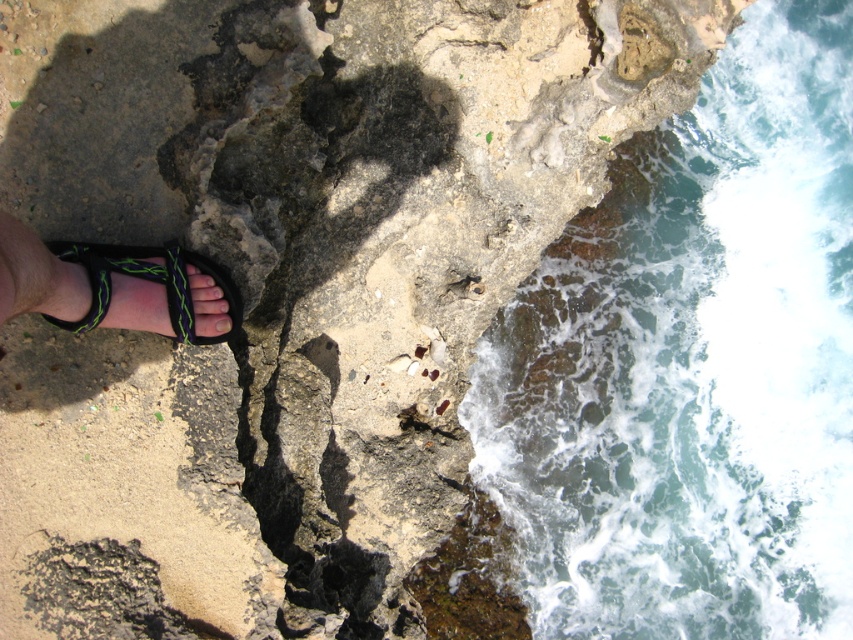
Is clear water at lower right to the right of pale yellow nail at lower left from the viewer's perspective?

Correct, you'll find clear water at lower right to the right of pale yellow nail at lower left.

Which of these two, clear water at lower right or pale yellow nail at lower left, stands taller?

With more height is clear water at lower right.

The height and width of the screenshot is (640, 853). Find the location of `clear water at lower right`. clear water at lower right is located at coordinates (692, 365).

Between clear water at lower right and black woven sandal at lower left, which one appears on the right side from the viewer's perspective?

clear water at lower right is more to the right.

Can you confirm if clear water at lower right is positioned below black woven sandal at lower left?

No, clear water at lower right is not below black woven sandal at lower left.

What are the coordinates of `clear water at lower right` in the screenshot? It's located at (692, 365).

Who is positioned more to the left, black woven sandal at lower left or pale yellow nail at lower left?

Positioned to the left is black woven sandal at lower left.

Consider the image. Can you confirm if black woven sandal at lower left is shorter than pale yellow nail at lower left?

In fact, black woven sandal at lower left may be taller than pale yellow nail at lower left.

Who is more forward, (165, 291) or (224, 332)?

Point (165, 291)

The image size is (853, 640). I want to click on black woven sandal at lower left, so click(149, 280).